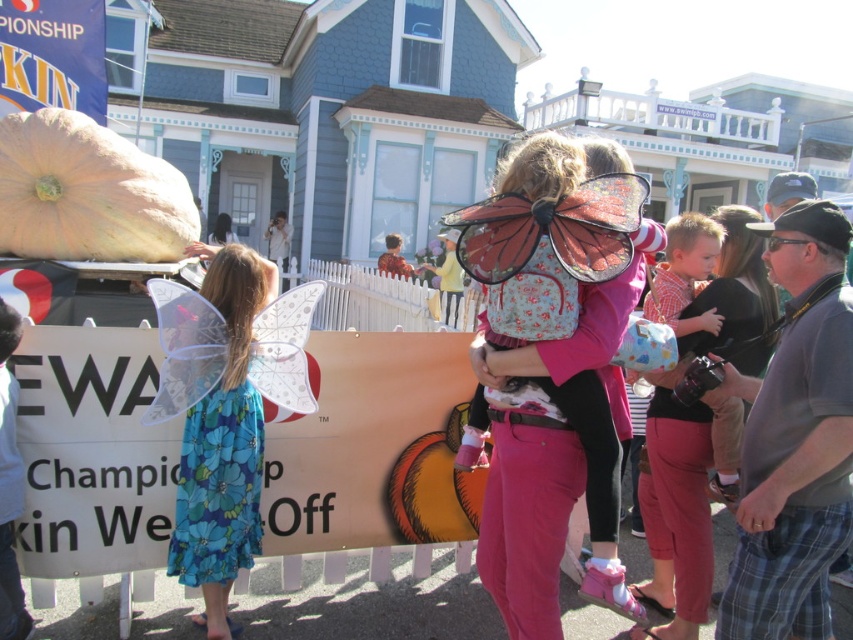
You are a photographer trying to capture a clear photo of the pink fabric wings at center and the matte pink pants at center. Which object should you focus on first if you want to ensure both are in focus, given their positions relative to the camera?

The pink fabric wings at center has a lesser height compared to matte pink pants at center, so you should focus on the pink fabric wings at center first to ensure both are in focus.

You are a photographer at the event and want to capture both the pink fabric wings at center and the blue floral dress at left in a single shot. Based on their positions and sizes, will you need to adjust your camera angle to ensure both are fully visible?

The pink fabric wings at center might be wider than blue floral dress at left, so you may need to adjust your camera angle to ensure both are fully visible in the shot.